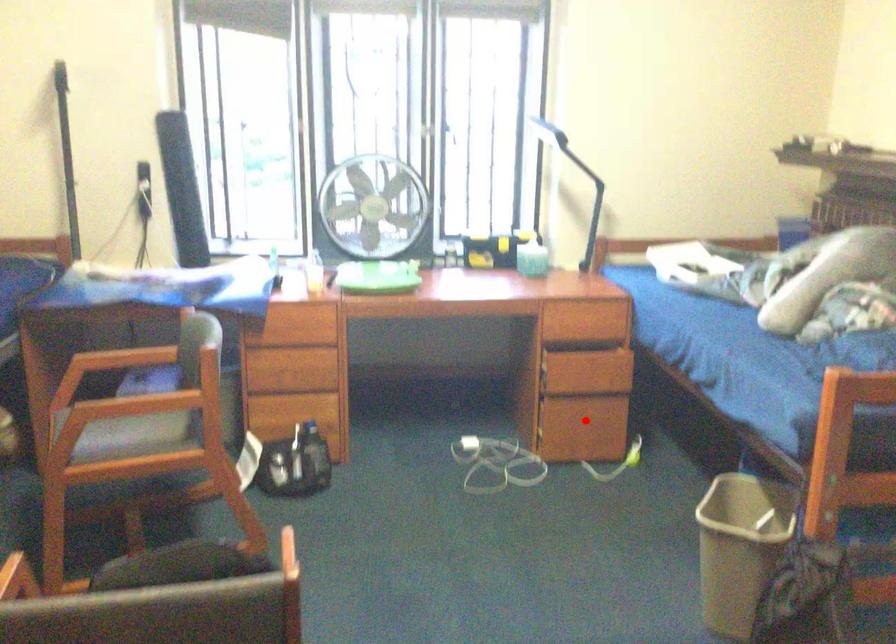
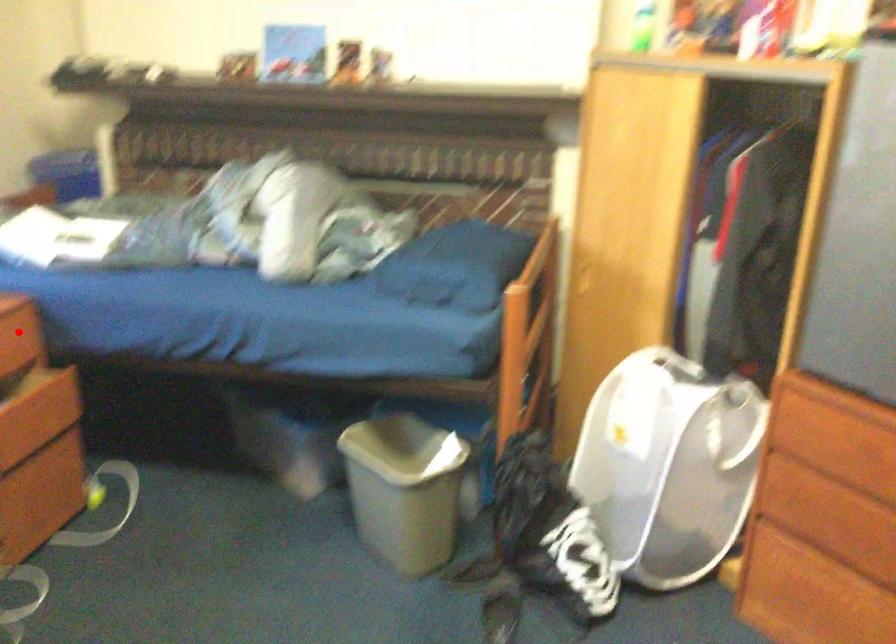
I am providing you with two images of the same scene from different viewpoints. A red point is marked on the first image and another point is marked on the second image. Is the marked point in image1 the same physical position as the marked point in image2?

No